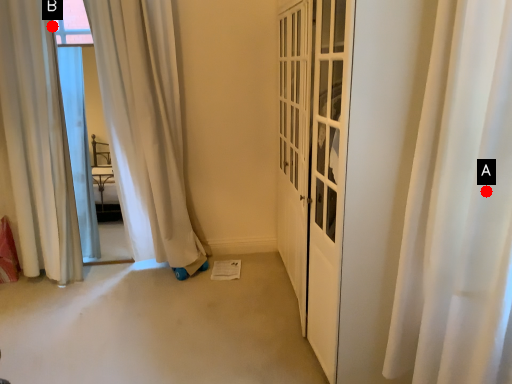
Question: Two points are circled on the image, labeled by A and B beside each circle. Among these points, which one is farthest from the camera?

Choices:
 (A) A is further
 (B) B is further

Answer: (B)